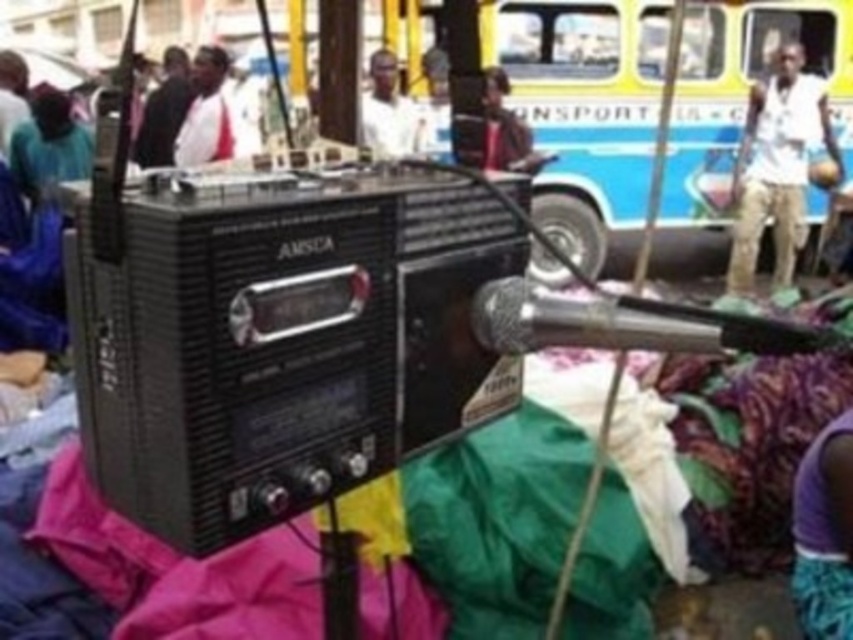
You are setting up equipment for an event and need to place a new speaker system between the silver metallic microphone at center and the matte black radio at lower left. Based on their current positions, which side of the microphone should the speaker system be placed to maintain alignment with the existing setup?

The speaker system should be placed to the right of the silver metallic microphone at center because the microphone is already positioned to the right of the matte black radio at lower left, so placing the speaker to the right maintains the alignment.

You are standing at the point with coordinates (776, 164) in the scene. What object is located exactly at this point?

The white cotton shirt at upper right is located exactly at point (776, 164).